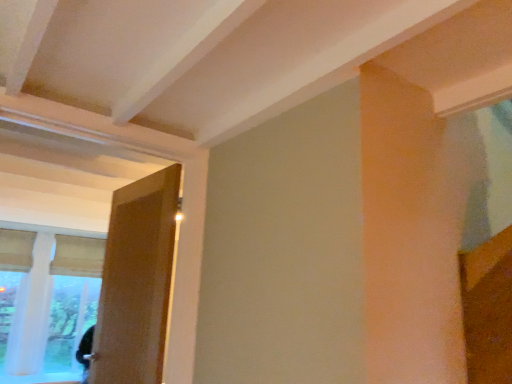
Measure the distance between point [158,375] and camera.

Point [158,375] is 1.92 meters from camera.

Describe the element at coordinates (136, 281) in the screenshot. Image resolution: width=512 pixels, height=384 pixels. I see `wooden door at left` at that location.

Locate an element on the screen. This screenshot has height=384, width=512. wooden door at left is located at coordinates (136, 281).

Identify the location of white sheer curtain at left. The image size is (512, 384). (46, 303).

This screenshot has width=512, height=384. What do you see at coordinates (46, 303) in the screenshot? I see `white sheer curtain at left` at bounding box center [46, 303].

Find the location of a particular element. Image resolution: width=512 pixels, height=384 pixels. wooden door at left is located at coordinates (136, 281).

Considering the positions of objects white sheer curtain at left and wooden door at left in the image provided, who is more to the right, white sheer curtain at left or wooden door at left?

wooden door at left.

Is white sheer curtain at left in front of or behind wooden door at left in the image?

white sheer curtain at left is positioned farther from the viewer than wooden door at left.

Is point (66, 372) in front of point (134, 213)?

No.

From the image's perspective, is white sheer curtain at left located above or below wooden door at left?

Based on their image positions, white sheer curtain at left is located beneath wooden door at left.

From a real-world perspective, who is located higher, white sheer curtain at left or wooden door at left?

From a 3D spatial view, wooden door at left is above.

Between white sheer curtain at left and wooden door at left, which one has smaller width?

wooden door at left is thinner.

Is white sheer curtain at left shorter than wooden door at left?

No.

In terms of size, does white sheer curtain at left appear bigger or smaller than wooden door at left?

In the image, white sheer curtain at left appears to be larger than wooden door at left.

Is white sheer curtain at left inside or outside of wooden door at left?

The correct answer is: outside.

Does white sheer curtain at left touch wooden door at left?

No, white sheer curtain at left is not making contact with wooden door at left.

Consider the image. Is white sheer curtain at left positioned with its back to wooden door at left?

That's not correct — white sheer curtain at left is not looking away from wooden door at left.

Can you tell me how much white sheer curtain at left and wooden door at left differ in facing direction?

white sheer curtain at left and wooden door at left are facing 82.9 degrees away from each other.

Measure the distance from white sheer curtain at left to wooden door at left.

white sheer curtain at left is 3.90 meters from wooden door at left.

You are a GUI agent. You are given a task and a screenshot of the screen. Output one action in this format:
    pyautogui.click(x=<x>, y=<y>)
    Task: Click on the door above the white sheer curtain at left (from a real-world perspective)
    
    Given the screenshot: What is the action you would take?
    pyautogui.click(x=136, y=281)

Considering the positions of objects wooden door at left and white sheer curtain at left in the image provided, who is more to the left, wooden door at left or white sheer curtain at left?

white sheer curtain at left is more to the left.

Is wooden door at left in front of white sheer curtain at left?

Yes, wooden door at left is closer to the viewer.

Considering the positions of point (164, 259) and point (39, 278), is point (164, 259) closer or farther from the camera than point (39, 278)?

Point (164, 259).

From the image's perspective, would you say wooden door at left is shown under white sheer curtain at left?

Incorrect, from the image's perspective, wooden door at left is higher than white sheer curtain at left.

From a real-world perspective, is wooden door at left on top of white sheer curtain at left?

Indeed, from a real-world perspective, wooden door at left stands above white sheer curtain at left.

Is wooden door at left wider or thinner than white sheer curtain at left?

In the image, wooden door at left appears to be more narrow than white sheer curtain at left.

Does wooden door at left have a lesser height compared to white sheer curtain at left?

Yes, wooden door at left is shorter than white sheer curtain at left.

Considering the relative sizes of wooden door at left and white sheer curtain at left in the image provided, is wooden door at left smaller than white sheer curtain at left?

Yes, wooden door at left is smaller than white sheer curtain at left.

Is white sheer curtain at left completely or partially inside wooden door at left?

No.

Is wooden door at left positioned far away from white sheer curtain at left?

That's right, there is a large distance between wooden door at left and white sheer curtain at left.

Is wooden door at left positioned with its back to white sheer curtain at left?

No, white sheer curtain at left is not at the back of wooden door at left.

How many degrees apart are the facing directions of wooden door at left and white sheer curtain at left?

The facing directions of wooden door at left and white sheer curtain at left are 82.9 degrees apart.

At what (x,y) coordinates should I click in order to perform the action: click on door on the right of white sheer curtain at left. Please return your answer as a coordinate pair (x, y). Looking at the image, I should click on (136, 281).

In order to click on window that is behind the wooden door at left in this screenshot , I will do `click(46, 303)`.

The image size is (512, 384). Find the location of `door in front of the white sheer curtain at left`. door in front of the white sheer curtain at left is located at coordinates (136, 281).